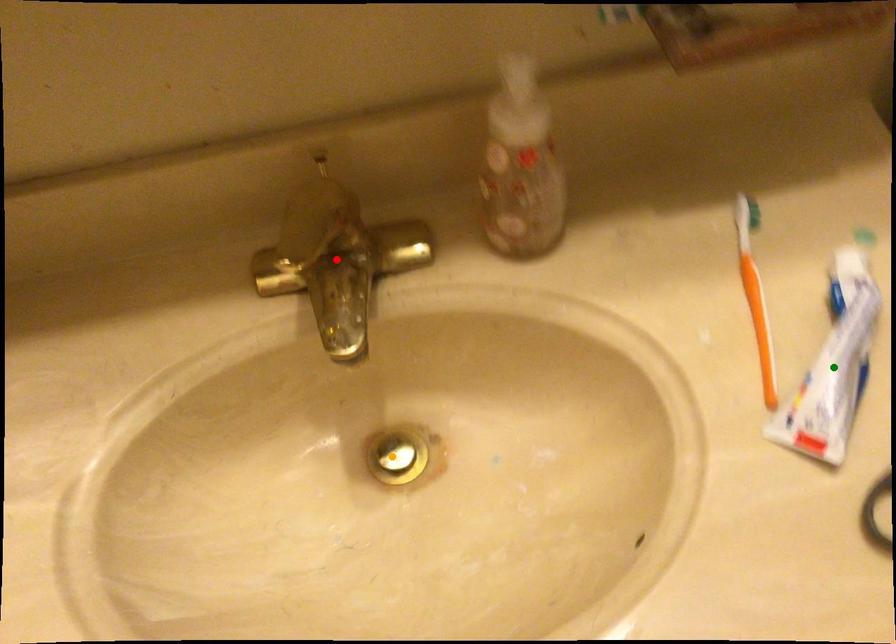
Order these from nearest to farthest:
orange point
red point
green point

green point < red point < orange point